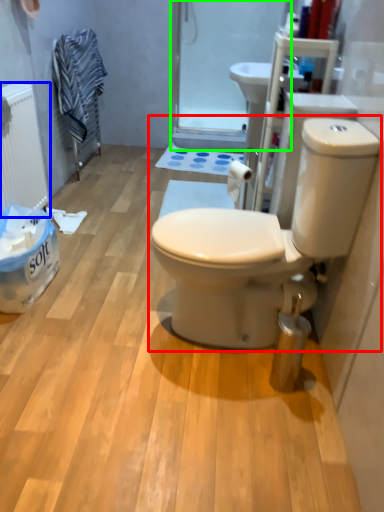
Question: Which object is positioned closest to toilet (highlighted by a red box)? Select from radiator (highlighted by a blue box) and screen door (highlighted by a green box).

Choices:
 (A) radiator
 (B) screen door

Answer: (A)